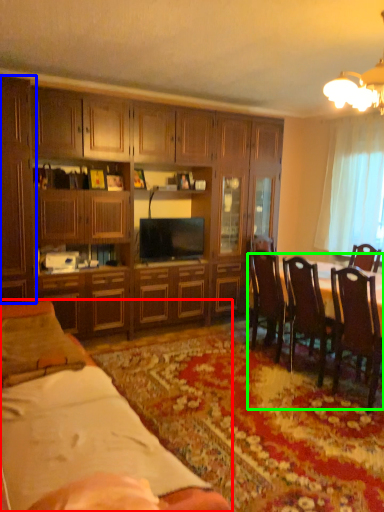
Question: Based on their relative distances, which object is nearer to desk (highlighted by a red box)? Choose from cabinetry (highlighted by a blue box) and kitchen & dining room table (highlighted by a green box).

Choices:
 (A) cabinetry
 (B) kitchen & dining room table

Answer: (A)